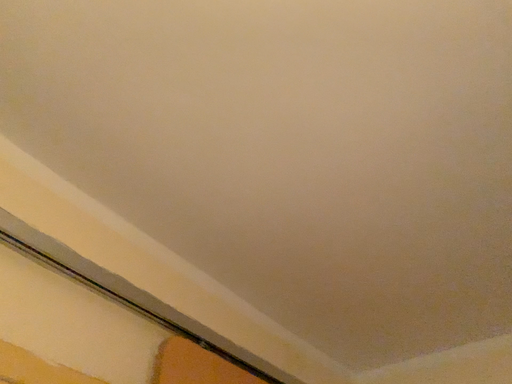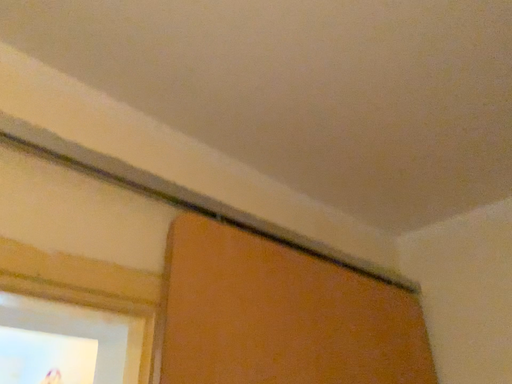
Question: Which way did the camera rotate in the video?

Choices:
 (A) rotated upward
 (B) rotated downward

Answer: (B)